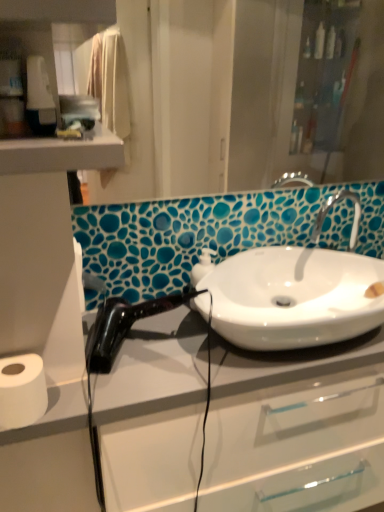
Question: Can we say white glossy sink at center lies outside white matte toilet paper at lower left?

Choices:
 (A) no
 (B) yes

Answer: (B)

Question: From a real-world perspective, is white glossy sink at center located higher than white matte toilet paper at lower left?

Choices:
 (A) yes
 (B) no

Answer: (A)

Question: Can you confirm if white glossy sink at center is wider than white matte toilet paper at lower left?

Choices:
 (A) no
 (B) yes

Answer: (B)

Question: From the image's perspective, is white glossy sink at center on white matte toilet paper at lower left?

Choices:
 (A) no
 (B) yes

Answer: (B)

Question: Does white glossy sink at center have a larger size compared to white matte toilet paper at lower left?

Choices:
 (A) yes
 (B) no

Answer: (A)

Question: Considering the positions of black glossy hair dryer at left and matte glass mirror at upper center in the image, is black glossy hair dryer at left bigger or smaller than matte glass mirror at upper center?

Choices:
 (A) small
 (B) big

Answer: (B)

Question: From the image's perspective, relative to matte glass mirror at upper center, is black glossy hair dryer at left above or below?

Choices:
 (A) below
 (B) above

Answer: (A)

Question: Considering their positions, is black glossy hair dryer at left located in front of or behind matte glass mirror at upper center?

Choices:
 (A) behind
 (B) front

Answer: (B)

Question: Do you think black glossy hair dryer at left is within matte glass mirror at upper center, or outside of it?

Choices:
 (A) inside
 (B) outside

Answer: (B)

Question: Is black plastic hair dryer at upper left spatially inside white matte toilet paper at lower left, or outside of it?

Choices:
 (A) inside
 (B) outside

Answer: (B)

Question: From a real-world perspective, is black plastic hair dryer at upper left above or below white matte toilet paper at lower left?

Choices:
 (A) above
 (B) below

Answer: (A)

Question: Is black plastic hair dryer at upper left in front of or behind white matte toilet paper at lower left in the image?

Choices:
 (A) front
 (B) behind

Answer: (A)

Question: Based on their sizes in the image, would you say black plastic hair dryer at upper left is bigger or smaller than white matte toilet paper at lower left?

Choices:
 (A) big
 (B) small

Answer: (B)

Question: Looking at their shapes, would you say white glossy sink at center is wider or thinner than matte glass mirror at upper center?

Choices:
 (A) wide
 (B) thin

Answer: (A)

Question: Is white glossy sink at center inside or outside of matte glass mirror at upper center?

Choices:
 (A) outside
 (B) inside

Answer: (A)